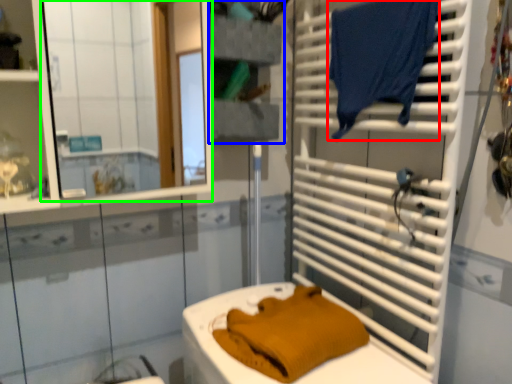
Question: Which is nearer to the laundry (highlighted by a red box)? shelf (highlighted by a blue box) or mirror (highlighted by a green box).

Choices:
 (A) shelf
 (B) mirror

Answer: (A)